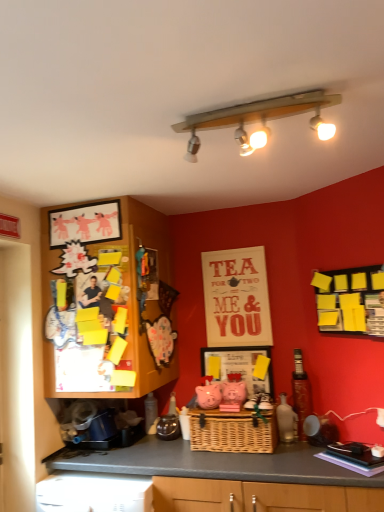
Question: In terms of width, does wooden with frosted glass lights at upper center look wider or thinner when compared to yellow sticky notes at upper right?

Choices:
 (A) wide
 (B) thin

Answer: (A)

Question: From the image's perspective, is wooden with frosted glass lights at upper center above or below yellow sticky notes at upper right?

Choices:
 (A) above
 (B) below

Answer: (A)

Question: Estimate the real-world distances between objects in this image. Which object is closer to the wooden with frosted glass lights at upper center?

Choices:
 (A) wooden picture frame at upper left, the 1th picture frame from the left
 (B) white plastic dishwasher at lower left
 (C) matte black coffee maker at center
 (D) matte white picture frame at center, arranged as the first picture frame when ordered from the bottom
 (E) wooden cabinet at left

Answer: (A)

Question: Which of these objects is positioned farthest from the matte white picture frame at center, which ranks as the 2th picture frame in top-to-bottom order?

Choices:
 (A) matte black coffee maker at center
 (B) wooden with frosted glass lights at upper center
 (C) wooden picture frame at upper left, the 1th picture frame from the left
 (D) yellow sticky notes at upper right
 (E) woven brown basket at center

Answer: (B)